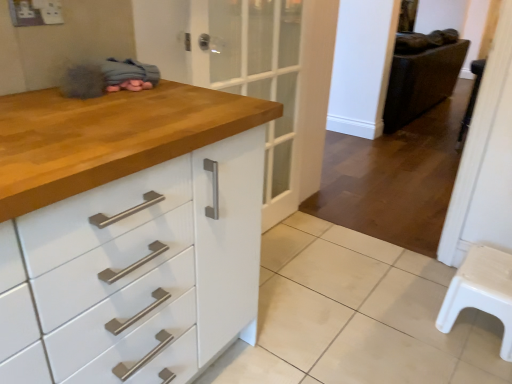
Question: Could you tell me if white plastic stool at lower right is facing leather-like dark brown chair at right?

Choices:
 (A) yes
 (B) no

Answer: (B)

Question: Is white plastic stool at lower right positioned with its back to leather-like dark brown chair at right?

Choices:
 (A) yes
 (B) no

Answer: (A)

Question: From the image's perspective, is white plastic stool at lower right below leather-like dark brown chair at right?

Choices:
 (A) yes
 (B) no

Answer: (A)

Question: Does white plastic stool at lower right lie in front of leather-like dark brown chair at right?

Choices:
 (A) no
 (B) yes

Answer: (B)

Question: Would you say white plastic stool at lower right is outside leather-like dark brown chair at right?

Choices:
 (A) yes
 (B) no

Answer: (A)

Question: Looking at their shapes, would you say leather-like dark brown chair at right is wider or thinner than white plastic step stool at right?

Choices:
 (A) thin
 (B) wide

Answer: (B)

Question: Considering their positions, is leather-like dark brown chair at right located in front of or behind white plastic step stool at right?

Choices:
 (A) front
 (B) behind

Answer: (B)

Question: Looking at the image, does leather-like dark brown chair at right seem bigger or smaller compared to white plastic step stool at right?

Choices:
 (A) big
 (B) small

Answer: (A)

Question: From their relative heights in the image, would you say leather-like dark brown chair at right is taller or shorter than white plastic step stool at right?

Choices:
 (A) tall
 (B) short

Answer: (A)

Question: Considering the positions of white plastic stool at lower right and white glossy tile at lower center in the image, is white plastic stool at lower right taller or shorter than white glossy tile at lower center?

Choices:
 (A) tall
 (B) short

Answer: (A)

Question: In the image, is white plastic stool at lower right positioned in front of or behind white glossy tile at lower center?

Choices:
 (A) behind
 (B) front

Answer: (A)

Question: Considering the positions of point (463, 297) and point (358, 319), is point (463, 297) closer or farther from the camera than point (358, 319)?

Choices:
 (A) closer
 (B) farther

Answer: (A)

Question: In terms of width, does white plastic stool at lower right look wider or thinner when compared to white glossy tile at lower center?

Choices:
 (A) wide
 (B) thin

Answer: (B)

Question: Relative to white plastic stool at lower right, is white glossy tile at lower center in front or behind?

Choices:
 (A) behind
 (B) front

Answer: (B)

Question: In terms of height, does white glossy tile at lower center look taller or shorter compared to white plastic stool at lower right?

Choices:
 (A) tall
 (B) short

Answer: (B)